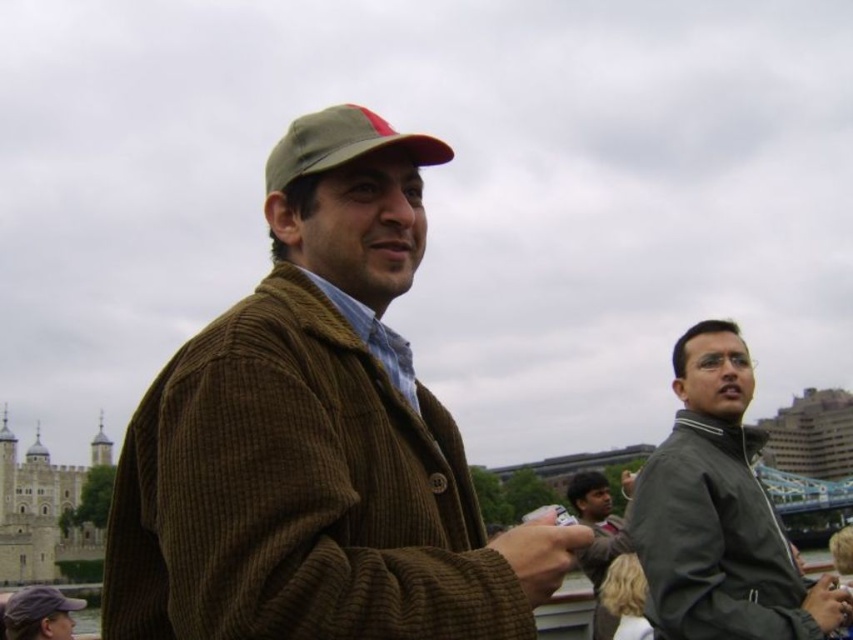
You are standing at the origin point in the image. Where is the dark green corduroy jacket at center located in terms of coordinates?

The dark green corduroy jacket at center is located at coordinates point (596, 540).

You are a photographer trying to capture a candid shot of the man in the brown corduroy jacket. You notice his brown corduroy hand at center and matte brown cap at center are partially blocking your view. Which object should you adjust your angle to avoid, considering their heights?

The brown corduroy hand at center has a lesser height compared to the matte brown cap at center, so you should adjust your angle to avoid the matte brown cap at center since it is taller and more likely to block the view.

You are standing in the public space near the historic building and bridge. There is a man in a brown corduroy jacket and green baseball cap with a red brim. Where exactly is the brown corduroy hand at center located in relation to the man?

The brown corduroy hand at center is located at point 0.867 on the x axis and 0.634 on the y axis.